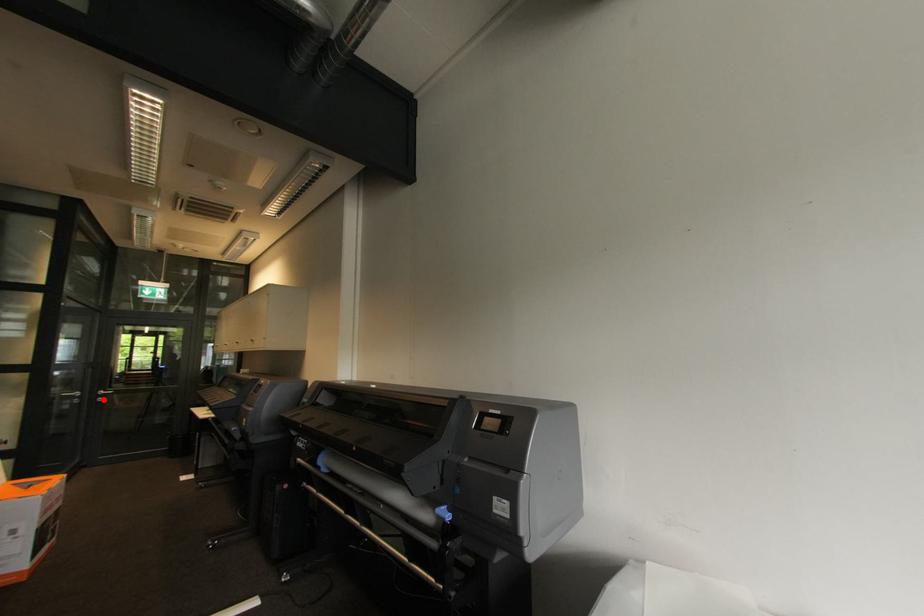
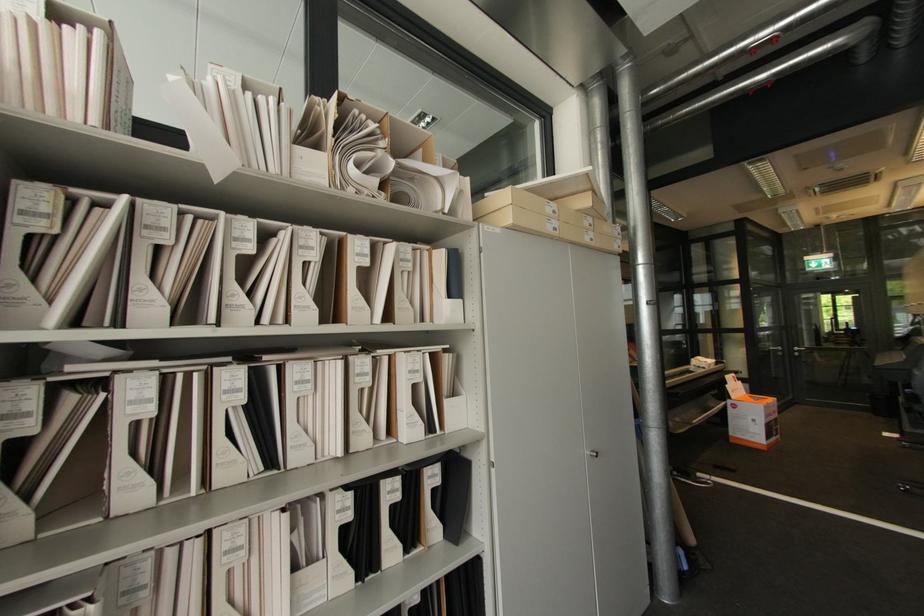
Question: I am providing you with two images of the same scene from different viewpoints. Image1 has a red point marked. In image2, the corresponding 3D location appears at what relative position? Reply with the corresponding letter.

Choices:
 (A) Closer
 (B) Farther

Answer: (A)